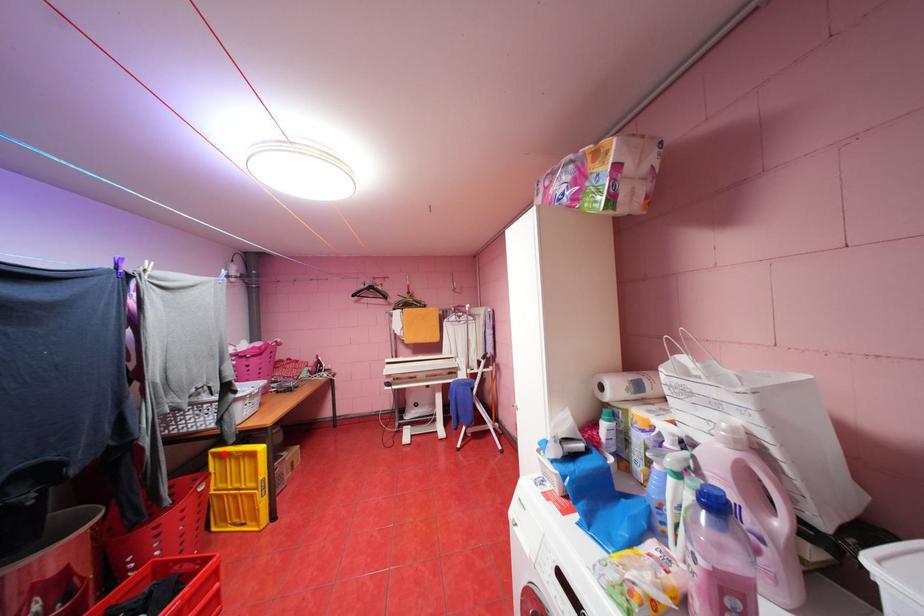
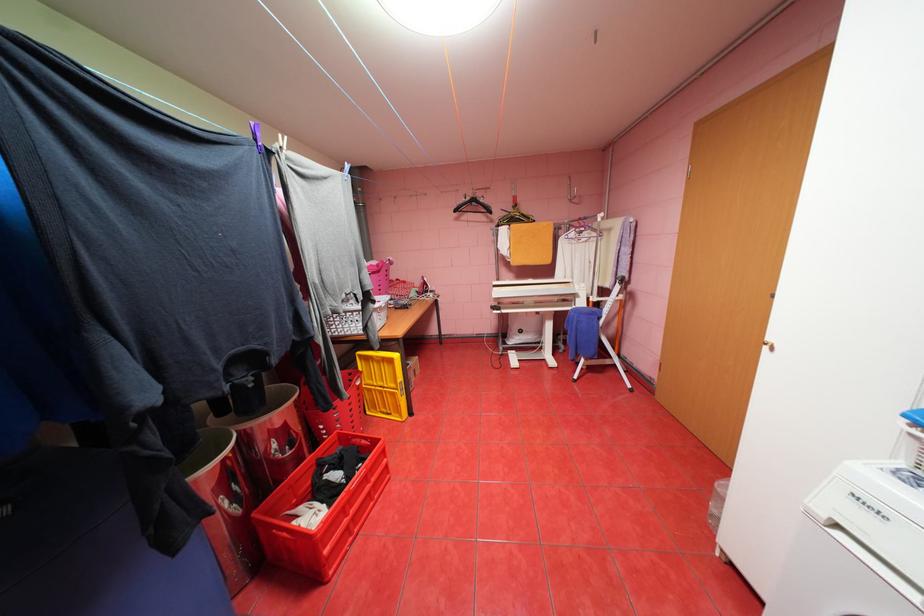
Find the pixel in the second image that matches the highlighted location in the first image.

(370, 355)